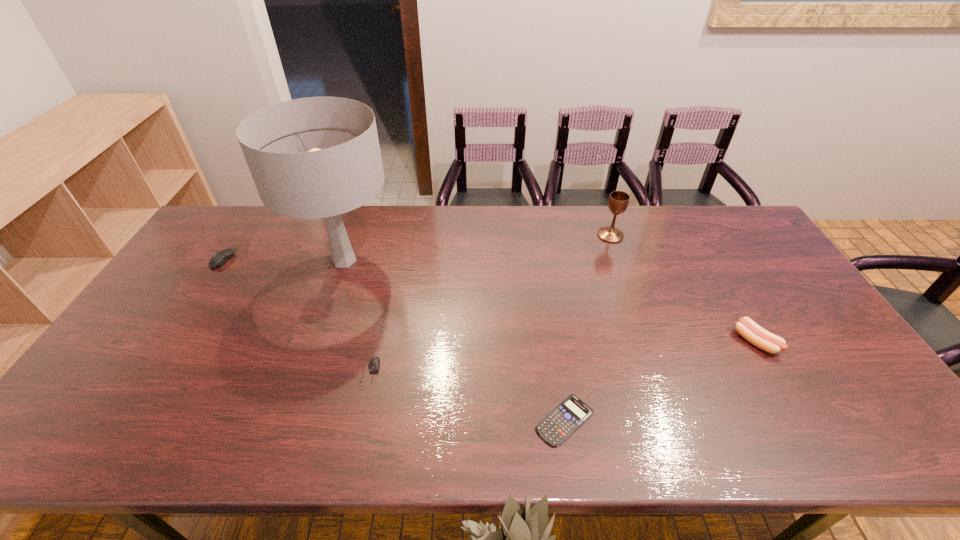
The height and width of the screenshot is (540, 960). I want to click on lampshade, so click(x=318, y=157).

The image size is (960, 540). In order to click on the second object from right to left in this screenshot , I will do `click(618, 202)`.

Find the location of `chalice`. chalice is located at coordinates (618, 202).

Locate an element on the screen. Image resolution: width=960 pixels, height=540 pixels. sausage is located at coordinates (747, 328).

Find the location of a particular element. This screenshot has height=540, width=960. the rightmost object is located at coordinates (747, 328).

You are a GUI agent. You are given a task and a screenshot of the screen. Output one action in this format:
    pyautogui.click(x=<x>, y=<y>)
    Task: Click on the taller mouse
    
    Given the screenshot: What is the action you would take?
    pyautogui.click(x=219, y=259)

The image size is (960, 540). Identify the location of the leftmost object. (219, 259).

You are a GUI agent. You are given a task and a screenshot of the screen. Output one action in this format:
    pyautogui.click(x=<x>, y=<y>)
    Task: Click on the fifth tallest object
    
    Given the screenshot: What is the action you would take?
    pyautogui.click(x=374, y=364)

Locate an element on the screen. The width and height of the screenshot is (960, 540). the nearer mouse is located at coordinates (374, 364).

Locate an element on the screen. Image resolution: width=960 pixels, height=540 pixels. calculator is located at coordinates (571, 413).